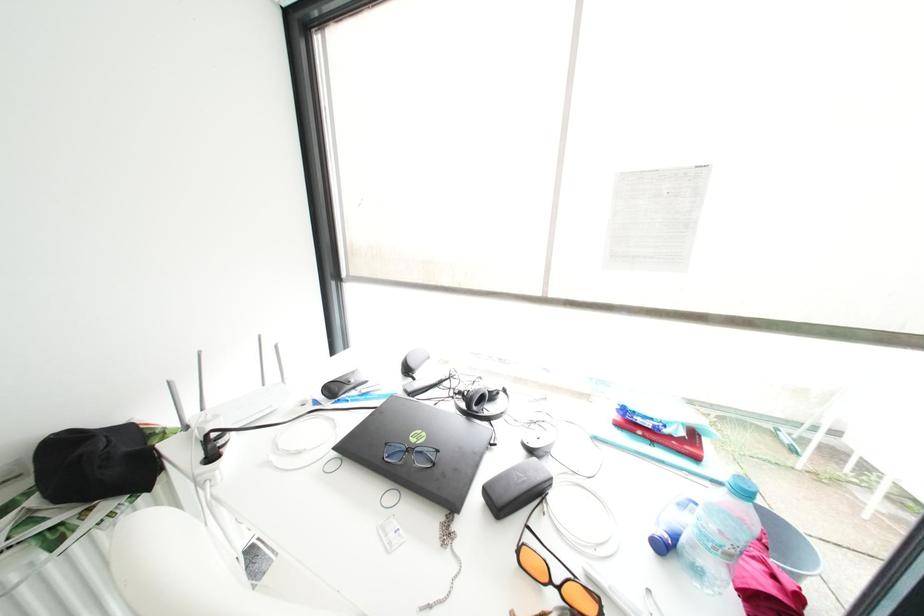
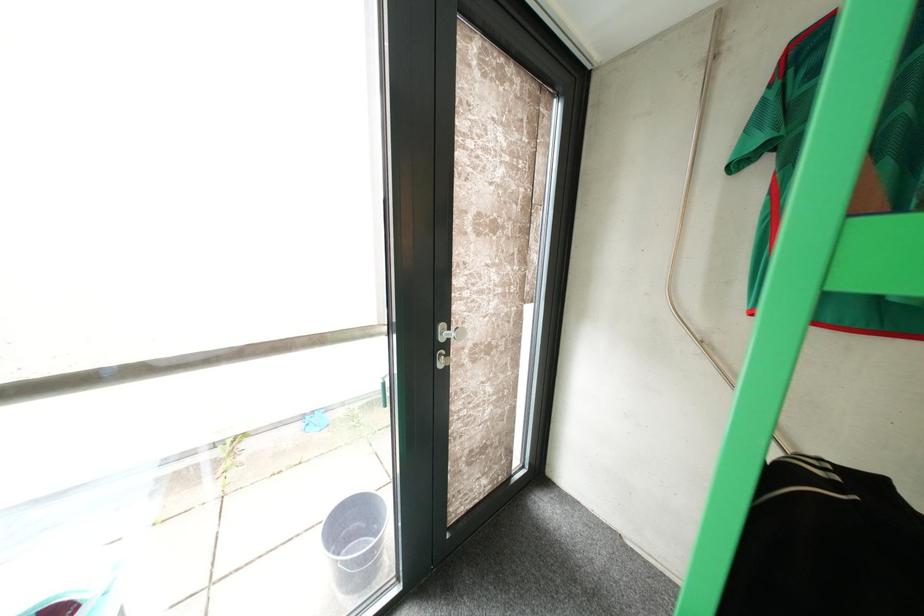
Question: Based on the continuous images, in which direction is the camera rotating? Reply with the corresponding letter.

Choices:
 (A) Left
 (B) Right
 (C) Up
 (D) Down

Answer: (B)